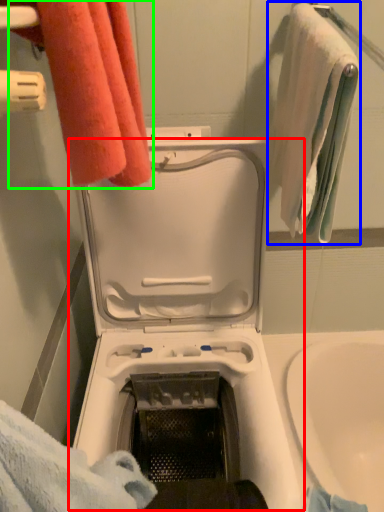
Question: Considering the real-world distances, which object is farthest from washing machine (highlighted by a red box)? towel (highlighted by a blue box) or towel (highlighted by a green box)?

Choices:
 (A) towel
 (B) towel

Answer: (B)